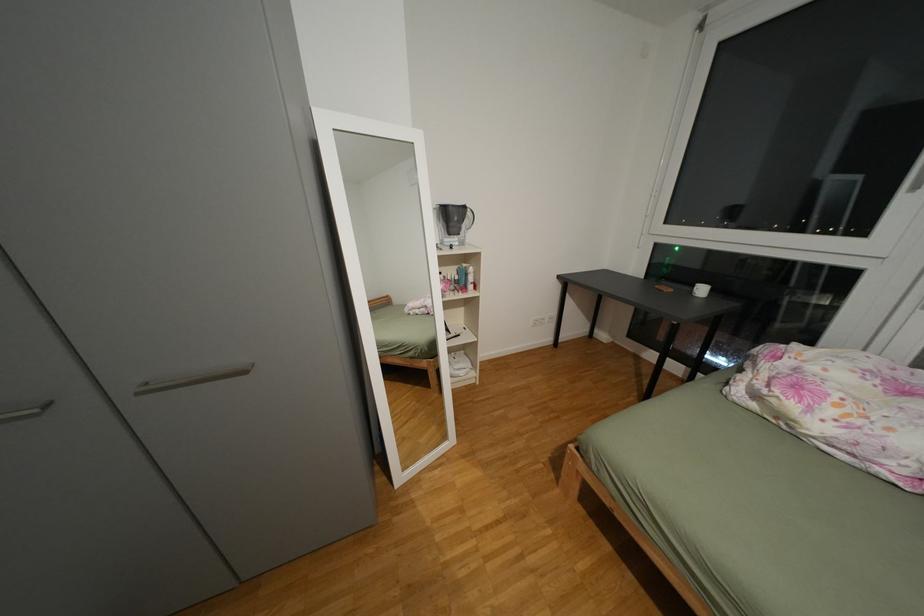
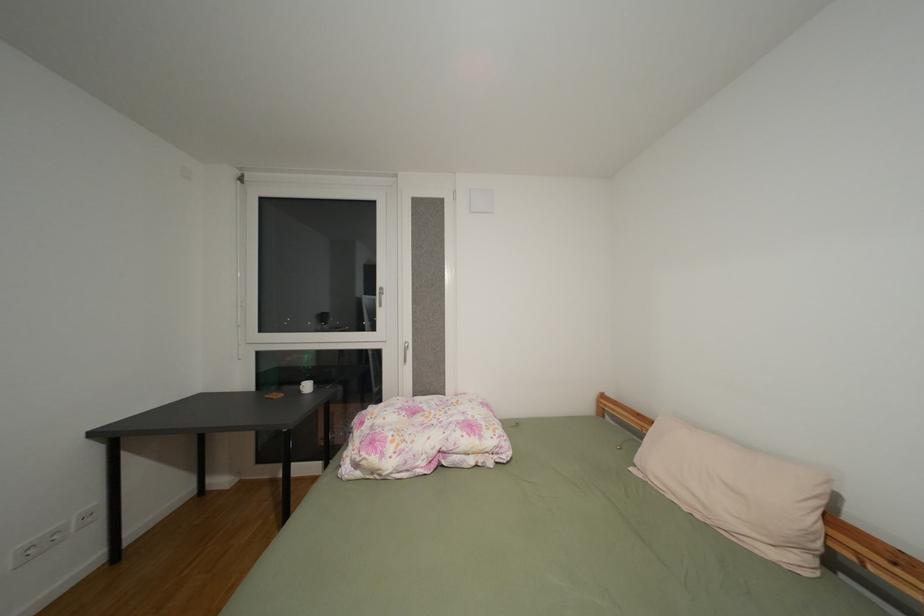
Question: The first image is from the beginning of the video and the second image is from the end. How did the camera likely rotate when shooting the video?

Choices:
 (A) Left
 (B) Right
 (C) Up
 (D) Down

Answer: (B)